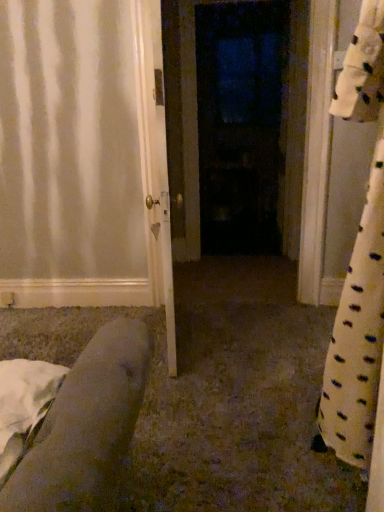
Question: Does point (226, 228) appear closer or farther from the camera than point (162, 173)?

Choices:
 (A) closer
 (B) farther

Answer: (B)

Question: Based on their positions, is dark matte door at center, placed as the first door when sorted from right to left, located to the left or right of white glossy door at center, arranged as the 2th door when viewed from the back?

Choices:
 (A) right
 (B) left

Answer: (A)

Question: From a real-world perspective, is dark matte door at center, marked as the second door in a front-to-back arrangement, above or below white glossy door at center, the 2th door viewed from the right?

Choices:
 (A) above
 (B) below

Answer: (A)

Question: In terms of size, does white glossy door at center, the 2th door viewed from the right, appear bigger or smaller than dark matte door at center, placed as the first door when sorted from right to left?

Choices:
 (A) big
 (B) small

Answer: (B)

Question: From a real-world perspective, is white glossy door at center, which is the first door from front to back, positioned above or below dark matte door at center, acting as the 1th door starting from the back?

Choices:
 (A) above
 (B) below

Answer: (B)

Question: Looking at their shapes, would you say white glossy door at center, the 1th door when ordered from left to right, is wider or thinner than dark matte door at center, which appears as the 2th door when viewed from the left?

Choices:
 (A) wide
 (B) thin

Answer: (B)

Question: Choose the correct answer: Is white glossy door at center, the 2th door viewed from the right, inside dark matte door at center, which appears as the 2th door when viewed from the left, or outside it?

Choices:
 (A) inside
 (B) outside

Answer: (B)